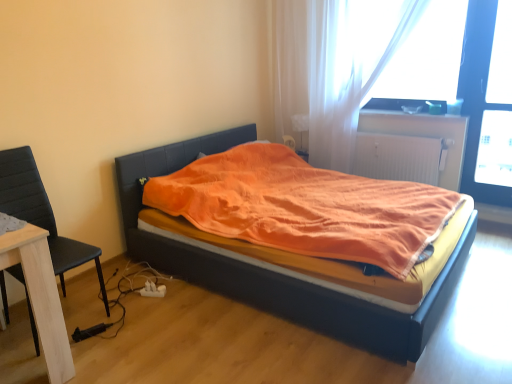
What are the coordinates of `transparent plastic window screen at upper right` in the screenshot? It's located at (426, 56).

Locate an element on the screen. transparent glass screen door at upper right is located at coordinates (478, 97).

Find the location of a particular element. The width and height of the screenshot is (512, 384). black leather chair at left is located at coordinates (41, 213).

This screenshot has width=512, height=384. I want to click on orange fabric bed at center, so click(x=270, y=271).

Locate an element on the screen. Image resolution: width=512 pixels, height=384 pixels. transparent plastic window screen at upper right is located at coordinates (426, 56).

Is transparent plastic window screen at upper right to the left or to the right of transparent glass screen door at upper right in the image?

Based on their positions, transparent plastic window screen at upper right is located to the left of transparent glass screen door at upper right.

The height and width of the screenshot is (384, 512). Find the location of `screen door located below the transparent plastic window screen at upper right (from the image's perspective)`. screen door located below the transparent plastic window screen at upper right (from the image's perspective) is located at coordinates (478, 97).

Is transparent plastic window screen at upper right next to transparent glass screen door at upper right?

No, transparent plastic window screen at upper right is not beside transparent glass screen door at upper right.

Can you confirm if transparent plastic window screen at upper right is shorter than transparent glass screen door at upper right?

Indeed, transparent plastic window screen at upper right has a lesser height compared to transparent glass screen door at upper right.

From the picture: Is orange fabric bed at center inside the boundaries of black leather chair at left, or outside?

orange fabric bed at center is located beyond the bounds of black leather chair at left.

From a real-world perspective, is orange fabric bed at center beneath black leather chair at left?

Indeed, from a real-world perspective, orange fabric bed at center is positioned beneath black leather chair at left.

Does orange fabric bed at center touch black leather chair at left?

No, orange fabric bed at center is not beside black leather chair at left.

Is black leather chair at left at the back of orange fabric bed at center?

No, orange fabric bed at center is not facing away from black leather chair at left.

How different are the orientations of white textured radiator at upper right and transparent plastic window screen at upper right in degrees?

There is a 0.0399-degree angle between the facing directions of white textured radiator at upper right and transparent plastic window screen at upper right.

Is point (397, 171) closer or farther from the camera than point (416, 97)?

Point (397, 171) appears to be farther away from the viewer than point (416, 97).

Which of these two, white textured radiator at upper right or transparent plastic window screen at upper right, is smaller?

white textured radiator at upper right is smaller.

How distant is white textured radiator at upper right from transparent plastic window screen at upper right?

white textured radiator at upper right and transparent plastic window screen at upper right are 24.59 inches apart.

Where is `window screen located above the black leather chair at left (from the image's perspective)`? The width and height of the screenshot is (512, 384). window screen located above the black leather chair at left (from the image's perspective) is located at coordinates (x=426, y=56).

Is black leather chair at left completely or partially outside of transparent plastic window screen at upper right?

Yes, black leather chair at left is not within transparent plastic window screen at upper right.

Who is taller, black leather chair at left or transparent plastic window screen at upper right?

black leather chair at left is taller.

Is transparent plastic window screen at upper right spatially inside black leather chair at left, or outside of it?

transparent plastic window screen at upper right exists outside the volume of black leather chair at left.

Does transparent plastic window screen at upper right touch black leather chair at left?

transparent plastic window screen at upper right and black leather chair at left are clearly separated.

Based on the photo, is transparent plastic window screen at upper right positioned before black leather chair at left?

No, transparent plastic window screen at upper right is behind black leather chair at left.

Is transparent plastic window screen at upper right bigger than black leather chair at left?

No.

Does orange fabric bed at center have a larger size compared to white textured radiator at upper right?

Correct, orange fabric bed at center is larger in size than white textured radiator at upper right.

How far apart are orange fabric bed at center and white textured radiator at upper right?

orange fabric bed at center and white textured radiator at upper right are 5.39 feet apart.

Are orange fabric bed at center and white textured radiator at upper right far apart?

That's right, there is a large distance between orange fabric bed at center and white textured radiator at upper right.

From the image's perspective, is orange fabric bed at center located above or below white textured radiator at upper right?

Clearly, from the image's perspective, orange fabric bed at center is below white textured radiator at upper right.

Can you tell me how much black leather chair at left and white textured radiator at upper right differ in facing direction?

There is a 88.8-degree angle between the facing directions of black leather chair at left and white textured radiator at upper right.

Between black leather chair at left and white textured radiator at upper right, which one has larger size?

With larger size is black leather chair at left.

Is black leather chair at left oriented towards white textured radiator at upper right?

No, black leather chair at left is not aimed at white textured radiator at upper right.

Is black leather chair at left in front of white textured radiator at upper right?

Yes.

Image resolution: width=512 pixels, height=384 pixels. Identify the location of window screen behind the transparent glass screen door at upper right. (426, 56).

Where is `chair below the orange fabric bed at center (from the image's perspective)`? This screenshot has height=384, width=512. chair below the orange fabric bed at center (from the image's perspective) is located at coordinates (41, 213).

Considering their positions, is black leather chair at left positioned further to white textured radiator at upper right than transparent plastic window screen at upper right?

Among the two, black leather chair at left is located further to white textured radiator at upper right.

Which object lies further to the anchor point transparent plastic window screen at upper right, white textured radiator at upper right or translucent fabric curtain at upper right?

Based on the image, white textured radiator at upper right appears to be further to transparent plastic window screen at upper right.

Estimate the real-world distances between objects in this image. Which object is closer to transparent plastic window screen at upper right, transparent glass screen door at upper right or white textured radiator at upper right?

Based on the image, transparent glass screen door at upper right appears to be nearer to transparent plastic window screen at upper right.

Considering their positions, is transparent glass screen door at upper right positioned closer to orange fabric bed at center than black leather chair at left?

black leather chair at left lies closer to orange fabric bed at center than the other object.

Looking at the image, which one is located closer to orange fabric bed at center, transparent glass screen door at upper right or white textured radiator at upper right?

white textured radiator at upper right lies closer to orange fabric bed at center than the other object.

When comparing their distances from transparent glass screen door at upper right, does transparent plastic window screen at upper right or translucent fabric curtain at upper right seem further?

Based on the image, translucent fabric curtain at upper right appears to be further to transparent glass screen door at upper right.

From the image, which object appears to be nearer to transparent plastic window screen at upper right, black leather chair at left or orange fabric bed at center?

orange fabric bed at center.

From the image, which object appears to be nearer to transparent plastic window screen at upper right, black leather chair at left or translucent fabric curtain at upper right?

translucent fabric curtain at upper right lies closer to transparent plastic window screen at upper right than the other object.

Find the location of a particular element. curtain between transparent plastic window screen at upper right and white textured radiator at upper right in the vertical direction is located at coordinates (328, 73).

Image resolution: width=512 pixels, height=384 pixels. Identify the location of bed situated between black leather chair at left and transparent plastic window screen at upper right from left to right. (270, 271).

The width and height of the screenshot is (512, 384). I want to click on curtain between orange fabric bed at center and transparent plastic window screen at upper right along the z-axis, so click(328, 73).

At what (x,y) coordinates should I click in order to perform the action: click on bed situated between black leather chair at left and white textured radiator at upper right from left to right. Please return your answer as a coordinate pair (x, y). Image resolution: width=512 pixels, height=384 pixels. Looking at the image, I should click on (270, 271).